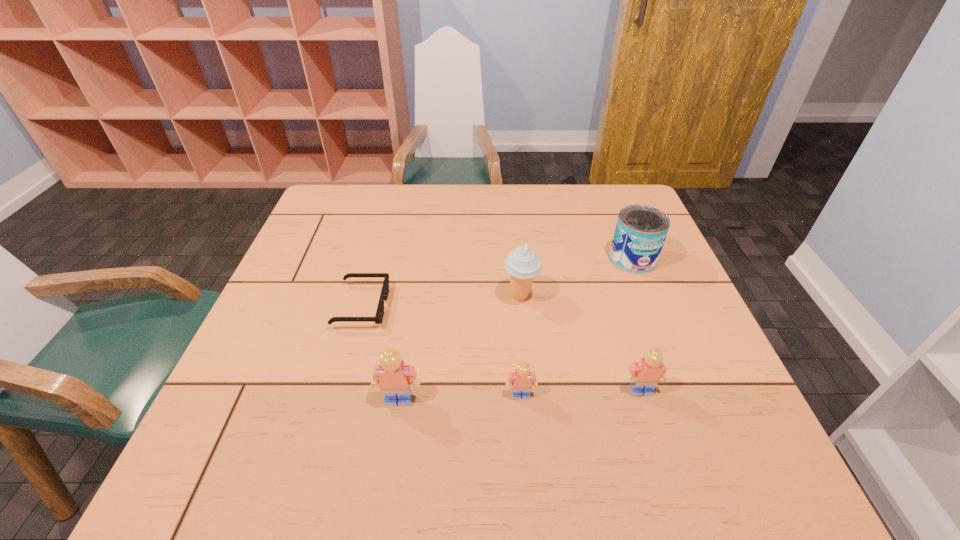
Identify the location of free space located on the front of the icecream. This screenshot has width=960, height=540. (526, 348).

What are the coordinates of `vacant area situated on the front of the farthest object` in the screenshot? It's located at (678, 373).

At what (x,y) coordinates should I click in order to perform the action: click on vacant position located on the front-facing side of the shortest object. Please return your answer as a coordinate pair (x, y). This screenshot has height=540, width=960. Looking at the image, I should click on (427, 306).

This screenshot has height=540, width=960. Identify the location of Lego located in the right edge section of the desktop. (646, 374).

Where is `can that is at the right edge`? The width and height of the screenshot is (960, 540). can that is at the right edge is located at coordinates (640, 232).

Where is `object at the near right corner`? object at the near right corner is located at coordinates (646, 374).

This screenshot has width=960, height=540. Identify the location of free spot at the far edge of the desktop. (447, 202).

In the image, there is a desktop. At what (x,y) coordinates should I click in order to perform the action: click on vacant space at the near edge. Please return your answer as a coordinate pair (x, y). The width and height of the screenshot is (960, 540). Looking at the image, I should click on (329, 431).

You are a GUI agent. You are given a task and a screenshot of the screen. Output one action in this format:
    pyautogui.click(x=<x>, y=<y>)
    Task: Click on the vacant space at the left edge of the desktop
    
    Given the screenshot: What is the action you would take?
    pyautogui.click(x=231, y=379)

Identify the location of vacant space at the right edge of the desktop. The height and width of the screenshot is (540, 960). (623, 280).